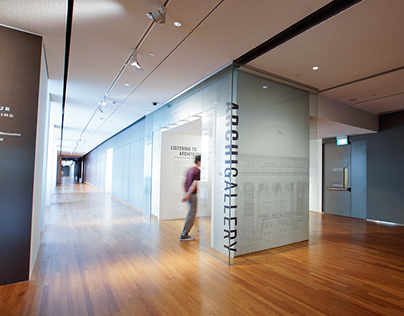
Where is `door handle`? The width and height of the screenshot is (404, 316). door handle is located at coordinates (336, 189).